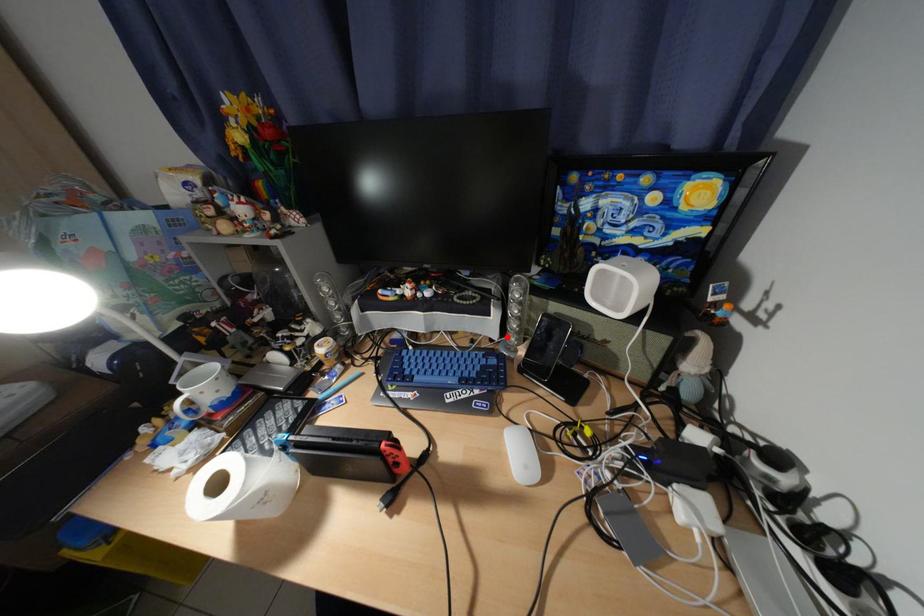
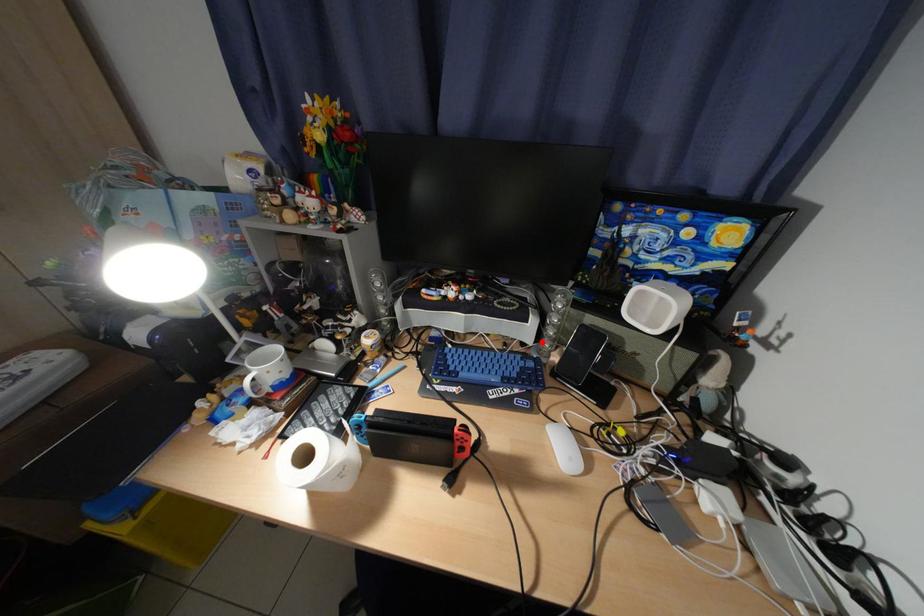
I am providing you with two images of the same scene from different viewpoints. A red point is marked on the first image and another point is marked on the second image. Does the point marked in image1 correspond to the same location as the one in image2?

Yes